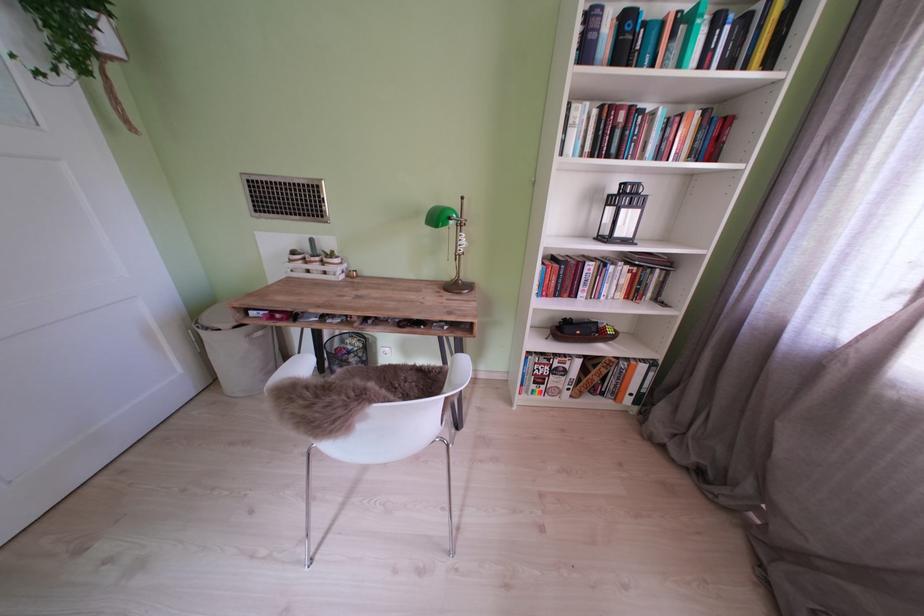
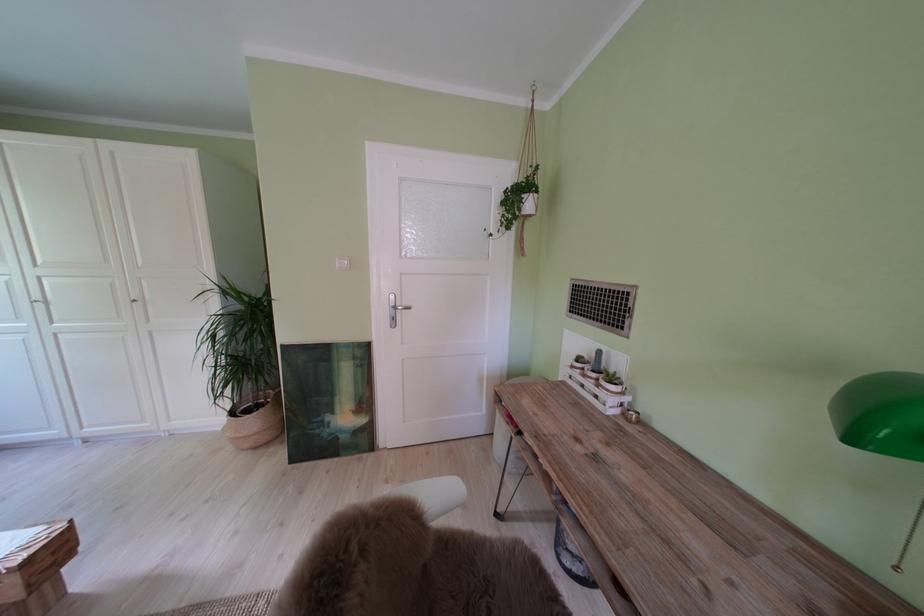
Question: The camera is either moving clockwise (left) or counter-clockwise (right) around the object. The first image is from the beginning of the video and the second image is from the end. Is the camera moving left or right when shooting the video?

Choices:
 (A) Left
 (B) Right

Answer: (B)